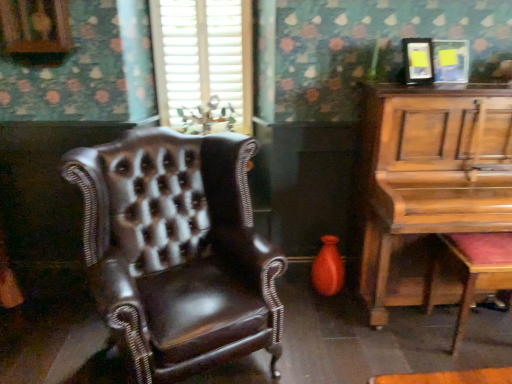
Question: Is wooden piano at right wider or thinner than shiny brown leather chair at left?

Choices:
 (A) wide
 (B) thin

Answer: (B)

Question: In terms of height, does wooden piano at right look taller or shorter compared to shiny brown leather chair at left?

Choices:
 (A) short
 (B) tall

Answer: (B)

Question: Which is farther from the white textured blinds at upper center?

Choices:
 (A) wooden piano at right
 (B) wooden polished music stool at lower right
 (C) shiny brown leather chair at left

Answer: (B)

Question: Which is nearer to the wooden piano at right?

Choices:
 (A) shiny brown leather chair at left
 (B) wooden polished music stool at lower right
 (C) white textured blinds at upper center

Answer: (B)